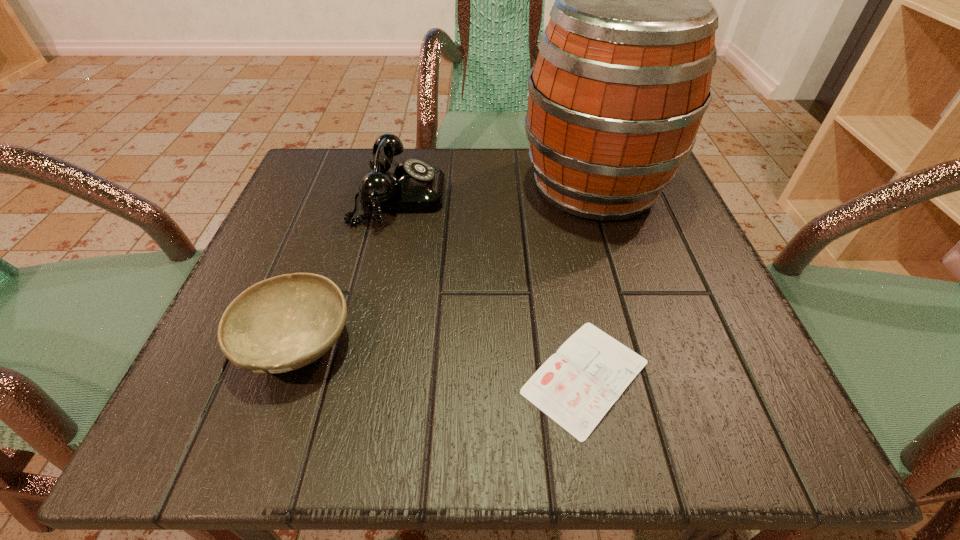
Locate an element on the screen. vacant area at the far edge is located at coordinates (507, 164).

The image size is (960, 540). What are the coordinates of `vacant space at the near edge` in the screenshot? It's located at (526, 441).

Where is `free region at the left edge`? The image size is (960, 540). free region at the left edge is located at coordinates tap(340, 218).

You are a GUI agent. You are given a task and a screenshot of the screen. Output one action in this format:
    pyautogui.click(x=<x>, y=<y>)
    Task: Click on the free space at the right edge of the desktop
    This screenshot has height=540, width=960.
    Given the screenshot: What is the action you would take?
    pyautogui.click(x=748, y=346)

The width and height of the screenshot is (960, 540). I want to click on free region at the far left corner of the desktop, so click(331, 204).

This screenshot has height=540, width=960. Identify the location of free area in between the bowl and the cider. (445, 264).

What are the coordinates of `blank region between the cider and the third tallest object` in the screenshot? It's located at (445, 264).

Where is `free space between the telephone and the third tallest object`? free space between the telephone and the third tallest object is located at coordinates [348, 269].

This screenshot has height=540, width=960. I want to click on vacant area between the telephone and the shortest object, so click(492, 287).

At what (x,y) coordinates should I click in order to perform the action: click on vacant area between the tallest object and the shortest object. Please return your answer as a coordinate pair (x, y). The image size is (960, 540). Looking at the image, I should click on (590, 281).